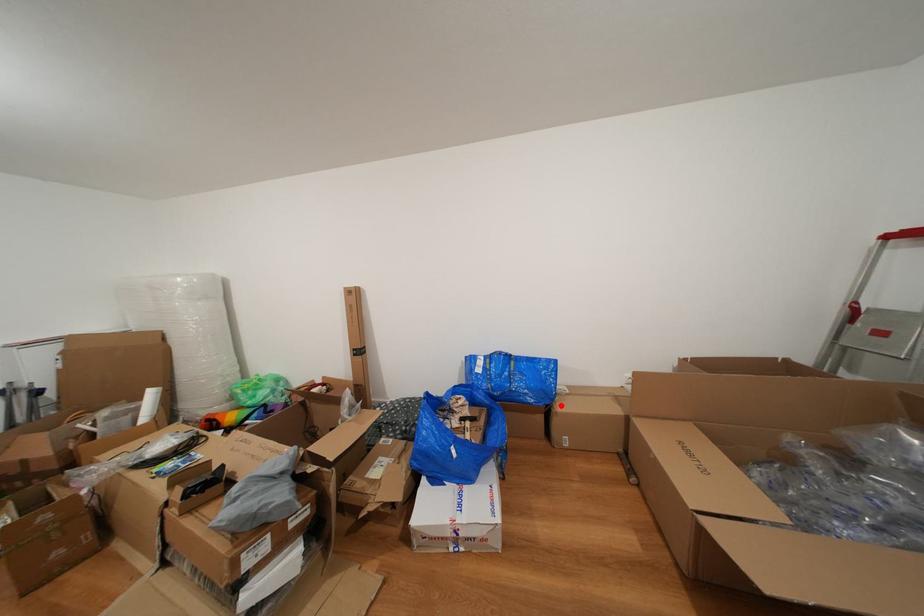
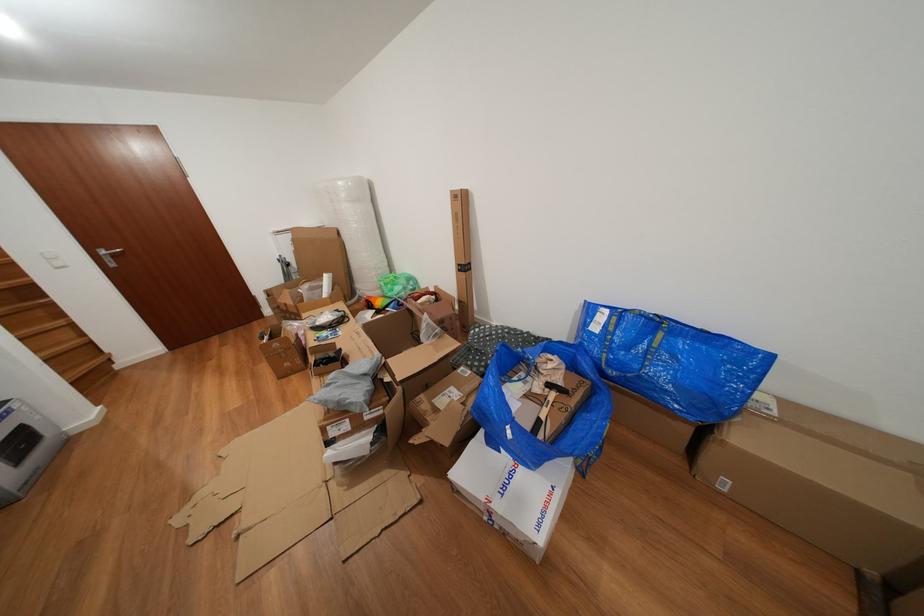
Question: I am providing you with two images of the same scene from different viewpoints. Image1 has a red point marked. In image2, the corresponding 3D location appears at what relative position? Reply with the corresponding letter.

Choices:
 (A) Closer
 (B) Farther

Answer: (A)